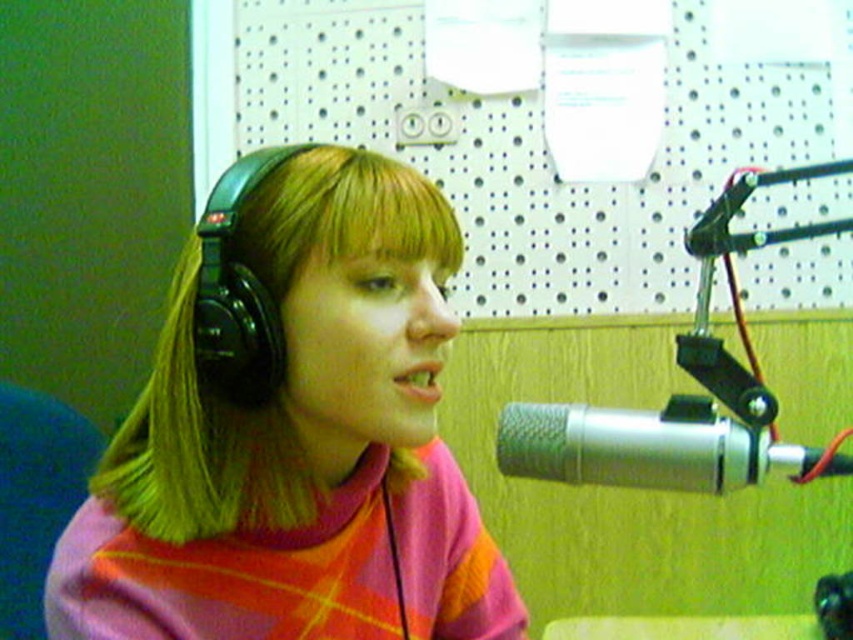
Can you confirm if matte black headphones at left is taller than silver/metallic microphone at right?

Yes.

Does point (314, 188) come closer to viewer compared to point (549, 410)?

Yes, point (314, 188) is closer to viewer.

Image resolution: width=853 pixels, height=640 pixels. Identify the location of matte black headphones at left. (297, 442).